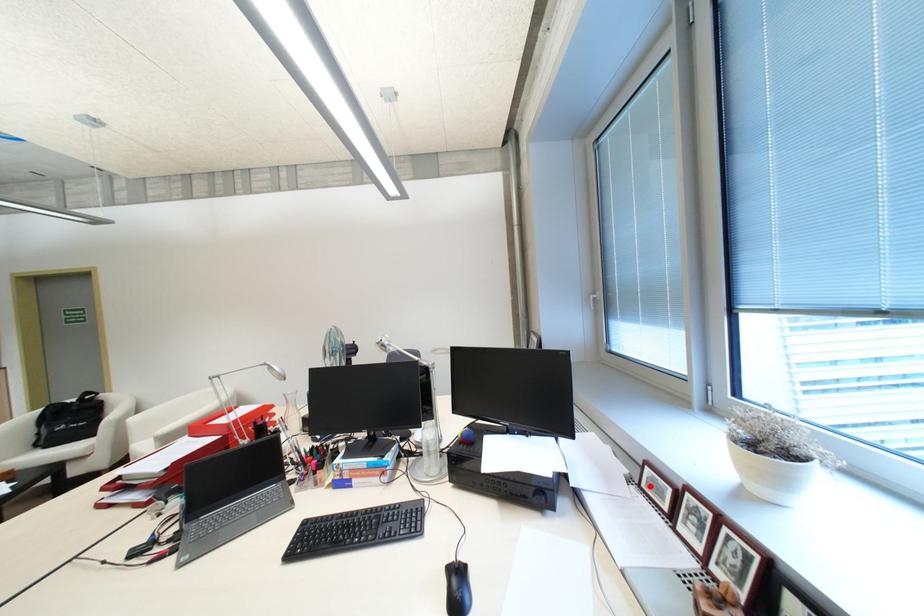
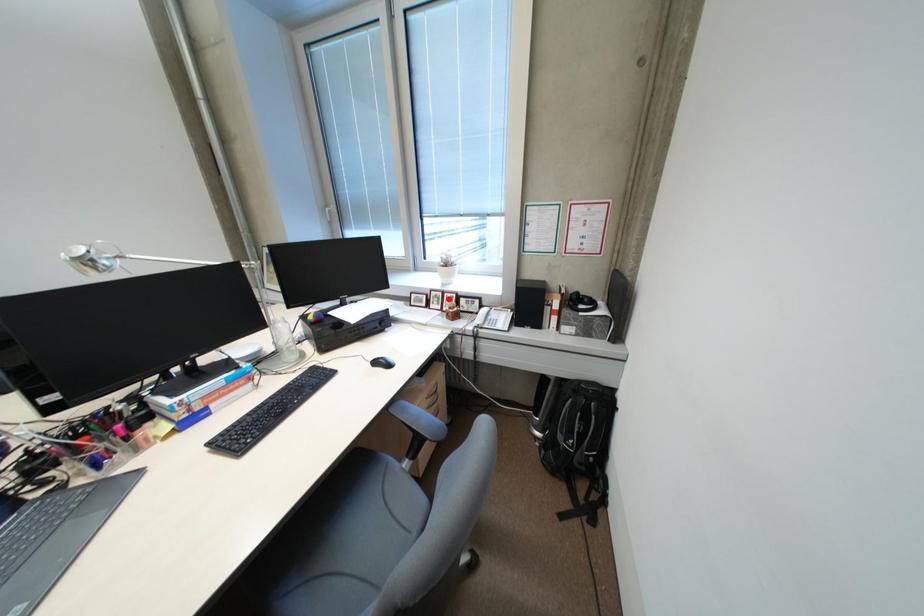
I am providing you with two images of the same scene from different viewpoints. A red point is marked on the first image and another point is marked on the second image. Are the points marked in image1 and image2 representing the same 3D position?

No